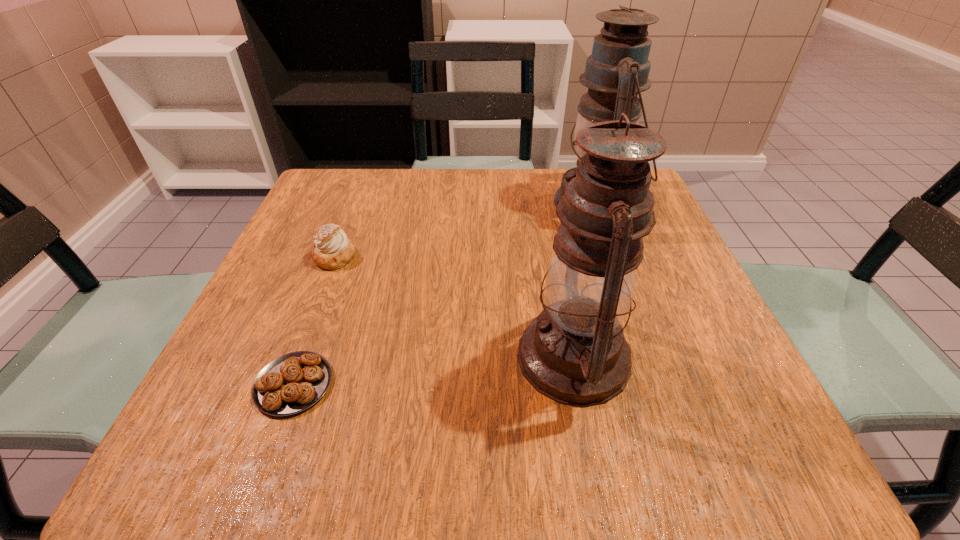
Find the location of a particular element. vacant point located between the farther pastry and the farther oil lamp is located at coordinates (465, 231).

The width and height of the screenshot is (960, 540). I want to click on object that is the third closest to the farther pastry, so click(617, 71).

The image size is (960, 540). I want to click on object that ranks as the second closest to the nearer pastry, so click(574, 352).

Where is `vacant position in the image that satisfies the following two spatial constraints: 1. on the back side of the farthest object; 2. on the left side of the farther pastry`? The height and width of the screenshot is (540, 960). vacant position in the image that satisfies the following two spatial constraints: 1. on the back side of the farthest object; 2. on the left side of the farther pastry is located at coordinates (355, 204).

Where is `blank area in the image that satisfies the following two spatial constraints: 1. on the front side of the taller pastry; 2. on the left side of the nearer oil lamp`? blank area in the image that satisfies the following two spatial constraints: 1. on the front side of the taller pastry; 2. on the left side of the nearer oil lamp is located at coordinates (296, 357).

This screenshot has height=540, width=960. In order to click on free space that satisfies the following two spatial constraints: 1. on the back side of the farthest object; 2. on the left side of the farther pastry in this screenshot , I will do `click(355, 204)`.